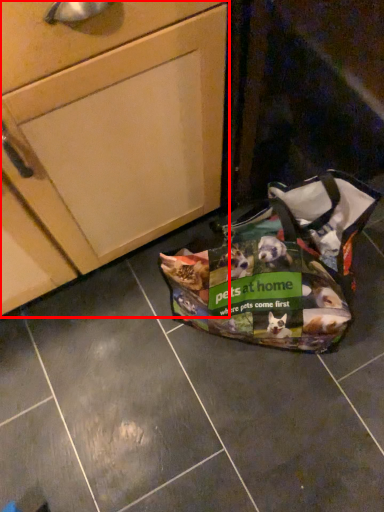
Question: Observing the image, what is the correct spatial positioning of cabinetry (annotated by the red box) in reference to handbag?

Choices:
 (A) right
 (B) left

Answer: (B)